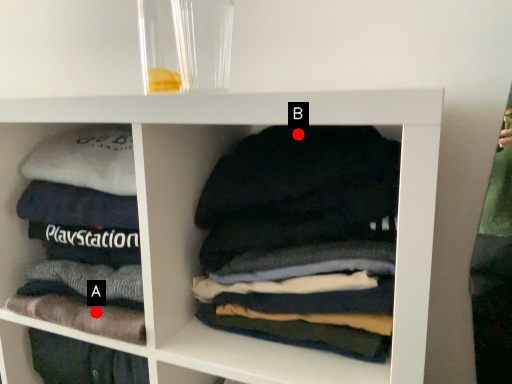
Question: Two points are circled on the image, labeled by A and B beside each circle. Which point is farther to the camera?

Choices:
 (A) A is further
 (B) B is further

Answer: (B)